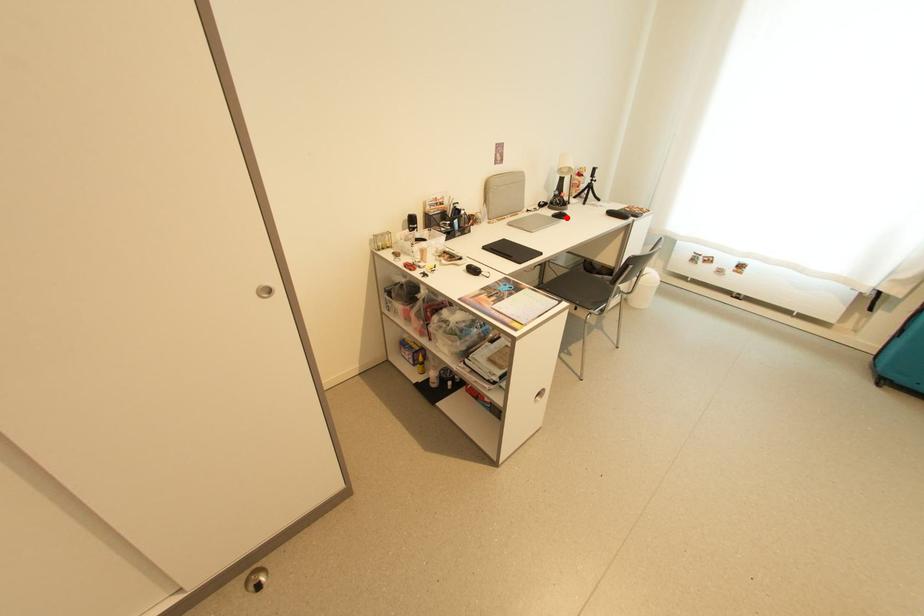
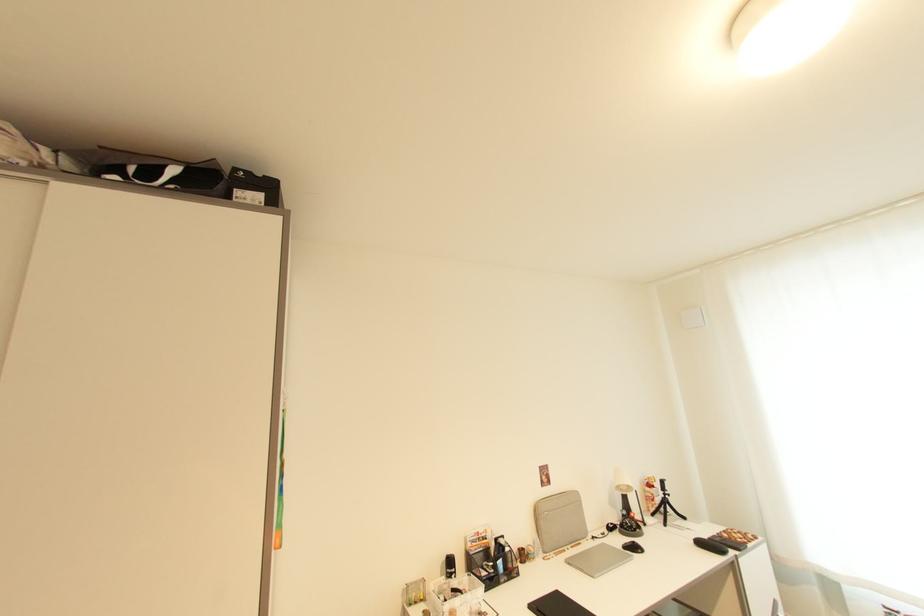
Question: I am providing you with two images of the same scene from different viewpoints. Given a red point in image1, look at the same physical point in image2. Is it:

Choices:
 (A) Closer to the viewpoint
 (B) Farther from the viewpoint

Answer: (B)